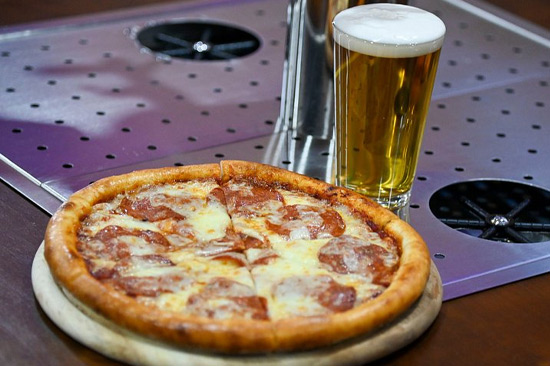
The height and width of the screenshot is (366, 550). I want to click on pizza board, so click(x=368, y=347).